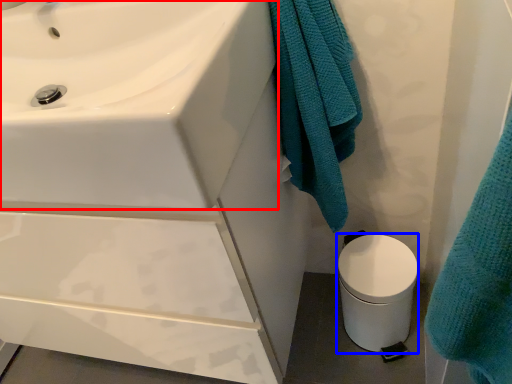
Question: Which point is closer to the camera, sink (highlighted by a red box) or toilet bowl (highlighted by a blue box)?

Choices:
 (A) sink
 (B) toilet bowl

Answer: (A)